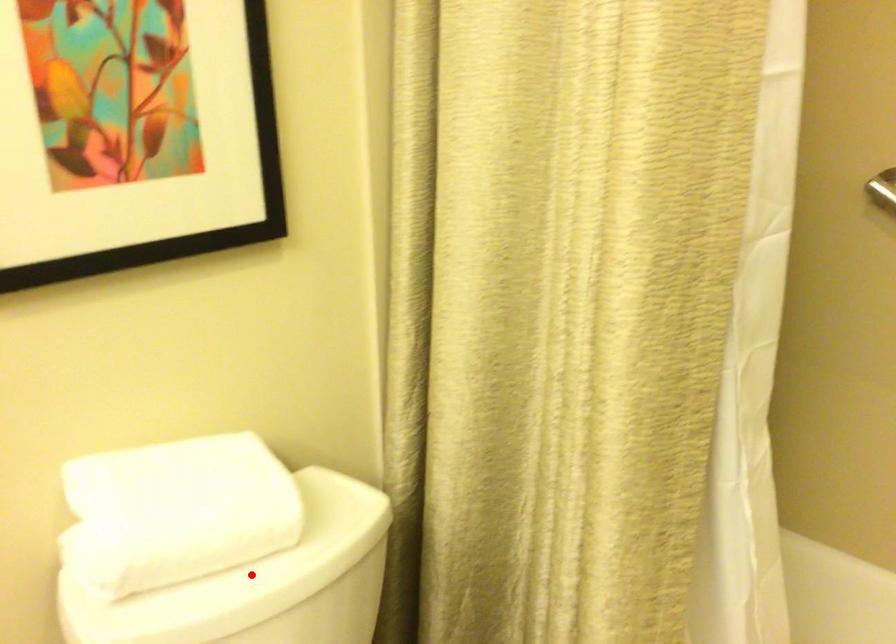
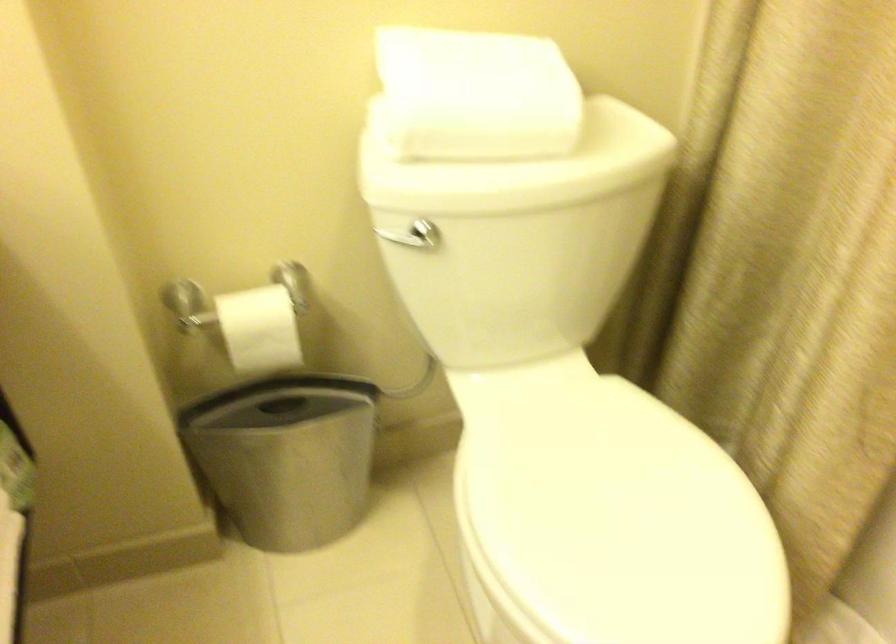
The point at the highlighted location is marked in the first image. Where is the corresponding point in the second image?

(519, 167)